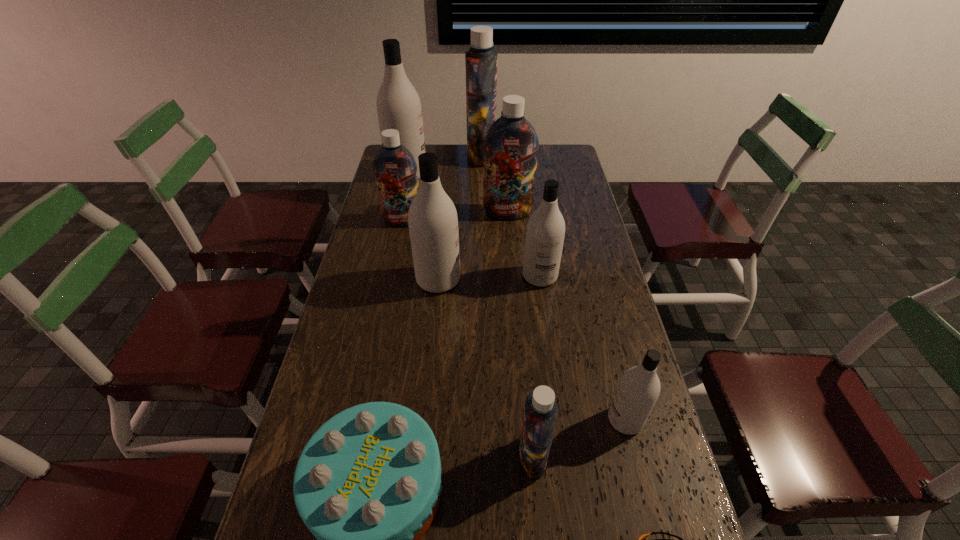
Where is `the biggest blue shampoo`? the biggest blue shampoo is located at coordinates (481, 60).

The height and width of the screenshot is (540, 960). I want to click on the leftmost white shampoo, so click(398, 105).

At what (x,y) coordinates should I click in order to perform the action: click on the farthest white shampoo. Please return your answer as a coordinate pair (x, y). This screenshot has width=960, height=540. Looking at the image, I should click on (398, 105).

Find the location of `the sixth shampoo from right to left`. the sixth shampoo from right to left is located at coordinates (432, 218).

Identify the location of the second white shampoo from left to right. (432, 218).

Image resolution: width=960 pixels, height=540 pixels. Identify the location of the third smallest blue shampoo. (511, 143).

At what (x,y) coordinates should I click in order to perform the action: click on the third white shampoo from left to right. Please return your answer as a coordinate pair (x, y). The image size is (960, 540). Looking at the image, I should click on (545, 233).

Identify the location of the leftmost blue shampoo. This screenshot has height=540, width=960. (395, 168).

Locate an element on the screen. the smallest blue shampoo is located at coordinates (540, 414).

You are a GUI agent. You are given a task and a screenshot of the screen. Output one action in this format:
    pyautogui.click(x=<x>, y=<y>)
    Task: Click on the nearest white shampoo
    The image size is (960, 540).
    Given the screenshot: What is the action you would take?
    pyautogui.click(x=638, y=390)